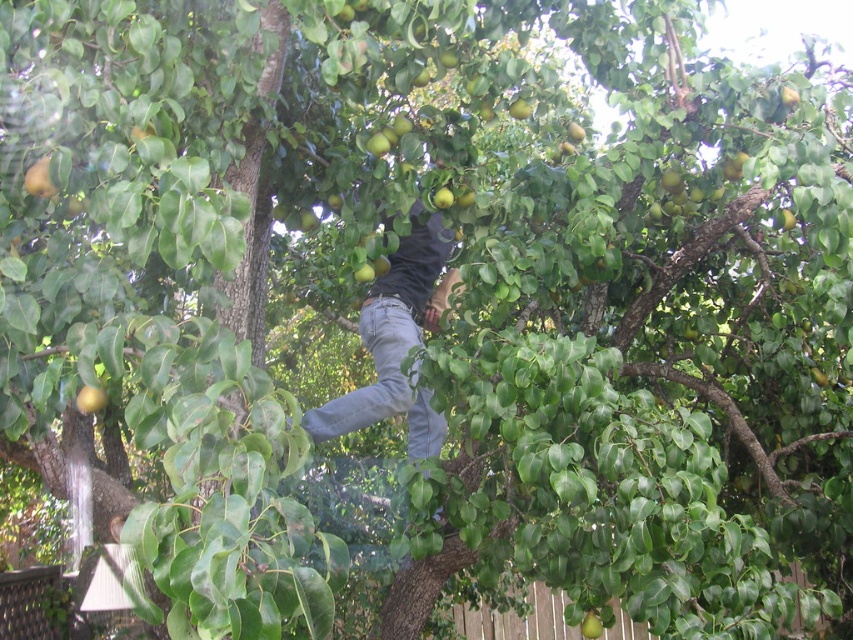
Question: Which object appears farthest from the camera in this image?

Choices:
 (A) green matte apple at lower left
 (B) denim jeans at center
 (C) green matte apple at upper left
 (D) green matte apple at center

Answer: (B)

Question: Can you confirm if green matte apple at upper left is smaller than green matte apple at lower left?

Choices:
 (A) yes
 (B) no

Answer: (A)

Question: Can you confirm if green matte apple at upper left is positioned to the left of green matte apple at lower left?

Choices:
 (A) yes
 (B) no

Answer: (A)

Question: Which is farther from the green matte apple at center?

Choices:
 (A) green matte apple at lower left
 (B) denim jeans at center
 (C) green matte apple at upper left

Answer: (C)

Question: Which is farther from the green matte apple at upper left?

Choices:
 (A) green matte apple at center
 (B) denim jeans at center

Answer: (B)

Question: Where is green matte apple at upper left located in relation to green matte apple at lower left in the image?

Choices:
 (A) above
 (B) below

Answer: (A)